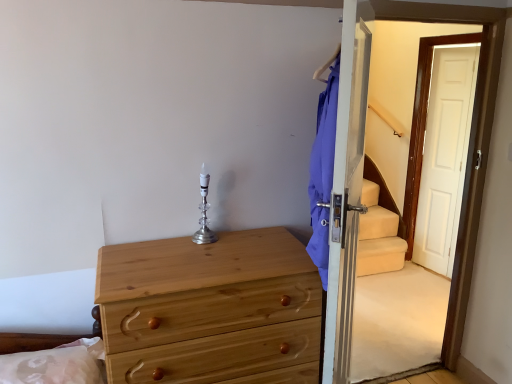
Locate an element on the screen. This screenshot has height=384, width=512. silky white pillow at lower left is located at coordinates (50, 367).

What do you see at coordinates (394, 219) in the screenshot? This screenshot has width=512, height=384. I see `transparent glass screen door at right` at bounding box center [394, 219].

Where is `silver/crystal candle holder at center`? silver/crystal candle holder at center is located at coordinates (204, 213).

Find the location of a particular element. The height and width of the screenshot is (384, 512). natural wood chest of drawers at lower left is located at coordinates pyautogui.click(x=208, y=307).

What are the coordinates of `pillow located on the left of silver/crystal candle holder at center` in the screenshot? It's located at (50, 367).

From the image's perspective, who appears lower, silky white pillow at lower left or silver/crystal candle holder at center?

silky white pillow at lower left appears lower in the image.

Looking at this image, considering the sizes of objects silky white pillow at lower left and silver/crystal candle holder at center in the image provided, who is taller, silky white pillow at lower left or silver/crystal candle holder at center?

silver/crystal candle holder at center.

Considering the sizes of objects transparent glass screen door at right and silky white pillow at lower left in the image provided, who is shorter, transparent glass screen door at right or silky white pillow at lower left?

With less height is silky white pillow at lower left.

From a real-world perspective, is transparent glass screen door at right physically above silky white pillow at lower left?

Yes.

In the scene shown: Would you consider transparent glass screen door at right to be distant from silky white pillow at lower left?

Yes.

Considering the positions of objects transparent glass screen door at right and silver/crystal candle holder at center in the image provided, who is more to the right, transparent glass screen door at right or silver/crystal candle holder at center?

Positioned to the right is transparent glass screen door at right.

Does transparent glass screen door at right have a lesser width compared to silver/crystal candle holder at center?

No.

From a real-world perspective, who is located lower, transparent glass screen door at right or silver/crystal candle holder at center?

transparent glass screen door at right, from a real-world perspective.

Considering the positions of points (392, 23) and (200, 173), is point (392, 23) farther from camera compared to point (200, 173)?

Yes, point (392, 23) is farther from viewer.

Is silky white pillow at lower left surrounded by natural wood chest of drawers at lower left?

No, silky white pillow at lower left is not surrounded by natural wood chest of drawers at lower left.

Does natural wood chest of drawers at lower left lie behind silky white pillow at lower left?

Yes, it is behind silky white pillow at lower left.

From the image's perspective, which one is positioned lower, natural wood chest of drawers at lower left or silky white pillow at lower left?

silky white pillow at lower left.

Are silver/crystal candle holder at center and transparent glass screen door at right beside each other?

They are not placed beside each other.

Does silver/crystal candle holder at center turn towards transparent glass screen door at right?

No.

Can you confirm if silver/crystal candle holder at center is thinner than transparent glass screen door at right?

Yes, silver/crystal candle holder at center is thinner than transparent glass screen door at right.

In the scene shown: Does silver/crystal candle holder at center have a larger size compared to transparent glass screen door at right?

No.

In terms of height, does silver/crystal candle holder at center look taller or shorter compared to silky white pillow at lower left?

Clearly, silver/crystal candle holder at center is taller compared to silky white pillow at lower left.

Can we say silver/crystal candle holder at center lies outside silky white pillow at lower left?

Yes, silver/crystal candle holder at center is outside of silky white pillow at lower left.

Is silver/crystal candle holder at center thinner than silky white pillow at lower left?

Yes, silver/crystal candle holder at center is thinner than silky white pillow at lower left.

Between silver/crystal candle holder at center and silky white pillow at lower left, which one appears on the right side from the viewer's perspective?

From the viewer's perspective, silver/crystal candle holder at center appears more on the right side.

Which is behind, point (163, 293) or point (198, 236)?

The point (198, 236) is farther.

Can you see natural wood chest of drawers at lower left touching silver/crystal candle holder at center?

No, natural wood chest of drawers at lower left is not making contact with silver/crystal candle holder at center.

Does natural wood chest of drawers at lower left come in front of silver/crystal candle holder at center?

Yes.

Considering the sizes of objects natural wood chest of drawers at lower left and silver/crystal candle holder at center in the image provided, who is thinner, natural wood chest of drawers at lower left or silver/crystal candle holder at center?

silver/crystal candle holder at center.

You are a GUI agent. You are given a task and a screenshot of the screen. Output one action in this format:
    pyautogui.click(x=<x>, y=<y>)
    Task: Click on the candle holder behind the silky white pillow at lower left
    The image size is (512, 384).
    Given the screenshot: What is the action you would take?
    pyautogui.click(x=204, y=213)

The width and height of the screenshot is (512, 384). Find the location of `pillow that is under the transparent glass screen door at right (from a real-world perspective)`. pillow that is under the transparent glass screen door at right (from a real-world perspective) is located at coordinates (50, 367).

Estimate the real-world distances between objects in this image. Which object is closer to silky white pillow at lower left, silver/crystal candle holder at center or natural wood chest of drawers at lower left?

natural wood chest of drawers at lower left is positioned closer to the anchor silky white pillow at lower left.

Which object lies further to the anchor point natural wood chest of drawers at lower left, silver/crystal candle holder at center or transparent glass screen door at right?

The object further to natural wood chest of drawers at lower left is transparent glass screen door at right.

Estimate the real-world distances between objects in this image. Which object is further from transparent glass screen door at right, silver/crystal candle holder at center or natural wood chest of drawers at lower left?

Among the two, silver/crystal candle holder at center is located further to transparent glass screen door at right.

Looking at the image, which one is located closer to silky white pillow at lower left, natural wood chest of drawers at lower left or silver/crystal candle holder at center?

natural wood chest of drawers at lower left.

Which object lies further to the anchor point transparent glass screen door at right, natural wood chest of drawers at lower left or silver/crystal candle holder at center?

silver/crystal candle holder at center lies further to transparent glass screen door at right than the other object.

Looking at the image, which one is located closer to transparent glass screen door at right, silky white pillow at lower left or natural wood chest of drawers at lower left?

natural wood chest of drawers at lower left.

From the image, which object appears to be farther from silver/crystal candle holder at center, transparent glass screen door at right or silky white pillow at lower left?

transparent glass screen door at right is positioned further to the anchor silver/crystal candle holder at center.

From the image, which object appears to be farther from transparent glass screen door at right, natural wood chest of drawers at lower left or silky white pillow at lower left?

Among the two, silky white pillow at lower left is located further to transparent glass screen door at right.

The height and width of the screenshot is (384, 512). Identify the location of chest of drawers between silver/crystal candle holder at center and silky white pillow at lower left in the vertical direction. (208, 307).

Locate an element on the screen. The image size is (512, 384). the chest of drawers located between silver/crystal candle holder at center and transparent glass screen door at right in the left-right direction is located at coordinates (208, 307).

Locate an element on the screen. The image size is (512, 384). chest of drawers between silky white pillow at lower left and transparent glass screen door at right is located at coordinates tap(208, 307).

You are a GUI agent. You are given a task and a screenshot of the screen. Output one action in this format:
    pyautogui.click(x=<x>, y=<y>)
    Task: Click on the candle holder situated between silky white pillow at lower left and transparent glass screen door at right from left to right
    This screenshot has height=384, width=512.
    Given the screenshot: What is the action you would take?
    pyautogui.click(x=204, y=213)